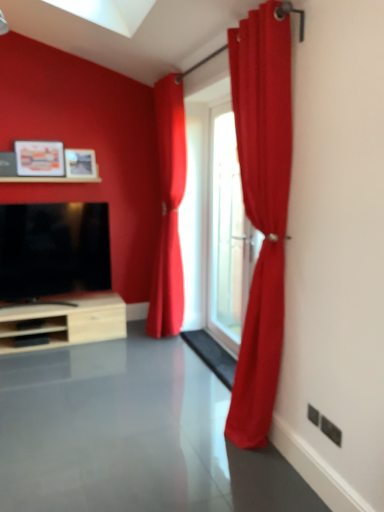
The height and width of the screenshot is (512, 384). What are the coordinates of `vacant area that lies in front of satin red curtain at center, placed as the first curtain when sorted from back to front` in the screenshot? It's located at (159, 352).